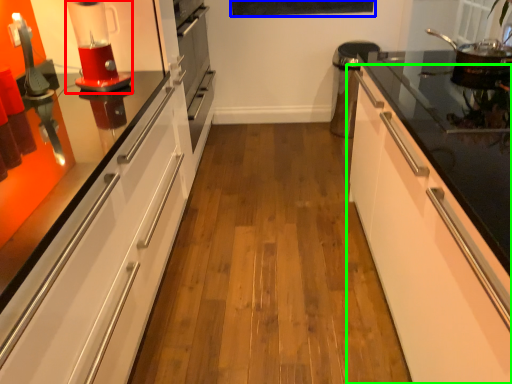
Question: Which object is the closest to the home appliance (highlighted by a red box)? Choose among these: bulletin board (highlighted by a blue box) or cabinetry (highlighted by a green box).

Choices:
 (A) bulletin board
 (B) cabinetry

Answer: (B)